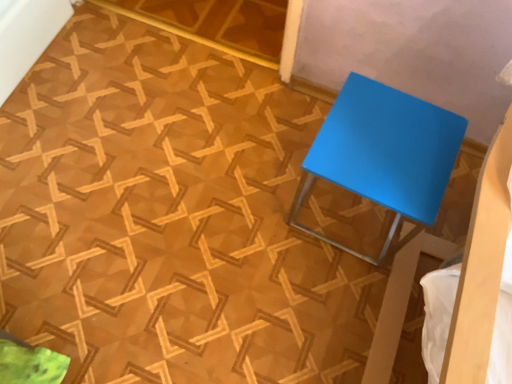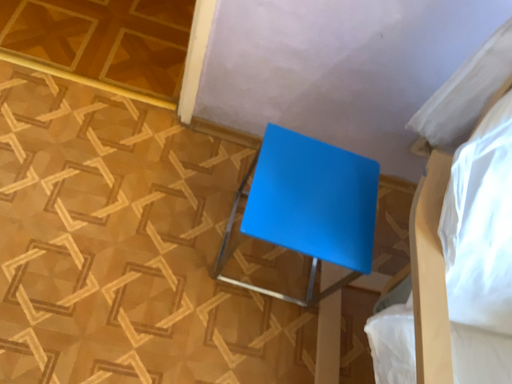
Question: Which way did the camera rotate in the video?

Choices:
 (A) rotated right
 (B) rotated left

Answer: (A)